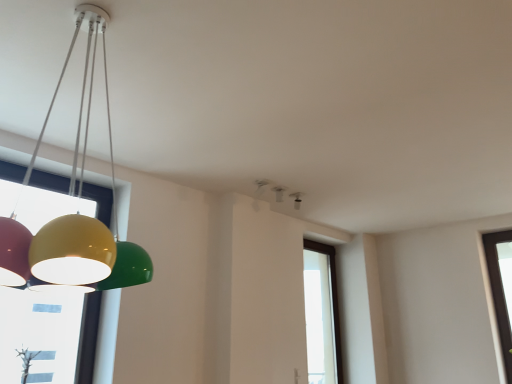
Question: Can glossy plastic lamp at left, the first lamp viewed from the left, be found inside transparent glass window at center?

Choices:
 (A) no
 (B) yes

Answer: (A)

Question: From the image's perspective, would you say transparent glass window at center is shown under glossy plastic lamp at left, which appears as the third lamp when viewed from the right?

Choices:
 (A) yes
 (B) no

Answer: (A)

Question: Considering the relative positions of transparent glass window at center and glossy plastic lamp at left, arranged as the 1th lamp when viewed from the front, in the image provided, is transparent glass window at center in front of glossy plastic lamp at left, arranged as the 1th lamp when viewed from the front,?

Choices:
 (A) no
 (B) yes

Answer: (A)

Question: Is transparent glass window at center smaller than glossy plastic lamp at left, placed as the 3th lamp when sorted from back to front?

Choices:
 (A) no
 (B) yes

Answer: (B)

Question: From the image's perspective, is transparent glass window at center over glossy plastic lamp at left, arranged as the 1th lamp when viewed from the front?

Choices:
 (A) yes
 (B) no

Answer: (B)

Question: Based on their sizes in the image, would you say white plastic smoke detector at upper center, arranged as the 2th lamp when viewed from the back, is bigger or smaller than transparent glass window at center?

Choices:
 (A) small
 (B) big

Answer: (A)

Question: Considering their positions, is white plastic smoke detector at upper center, which appears as the 2th lamp when viewed from the front, located in front of or behind transparent glass window at center?

Choices:
 (A) front
 (B) behind

Answer: (A)

Question: Does point (284, 190) appear closer or farther from the camera than point (308, 304)?

Choices:
 (A) closer
 (B) farther

Answer: (A)

Question: Considering the positions of white plastic smoke detector at upper center, which appears as the 2th lamp when viewed from the front, and transparent glass window at center in the image, is white plastic smoke detector at upper center, which appears as the 2th lamp when viewed from the front, wider or thinner than transparent glass window at center?

Choices:
 (A) wide
 (B) thin

Answer: (A)

Question: From a real-world perspective, is matte black speaker at upper center, the 1th lamp positioned from the back, positioned above or below white plastic smoke detector at upper center, marked as the second lamp in a right-to-left arrangement?

Choices:
 (A) below
 (B) above

Answer: (A)

Question: Is matte black speaker at upper center, the 3th lamp when ordered from left to right, inside the boundaries of white plastic smoke detector at upper center, which ranks as the 2th lamp in left-to-right order, or outside?

Choices:
 (A) inside
 (B) outside

Answer: (B)

Question: In terms of height, does matte black speaker at upper center, the 3th lamp when ordered from left to right, look taller or shorter compared to white plastic smoke detector at upper center, arranged as the 2th lamp when viewed from the back?

Choices:
 (A) short
 (B) tall

Answer: (B)

Question: From the image's perspective, relative to white plastic smoke detector at upper center, which ranks as the 2th lamp in left-to-right order, is matte black speaker at upper center, the 3th lamp when ordered from left to right, above or below?

Choices:
 (A) above
 (B) below

Answer: (B)

Question: In the image, is transparent glass window at center positioned in front of or behind white plastic smoke detector at upper center, marked as the second lamp in a right-to-left arrangement?

Choices:
 (A) front
 (B) behind

Answer: (B)

Question: Is transparent glass window at center wider or thinner than white plastic smoke detector at upper center, which ranks as the 2th lamp in left-to-right order?

Choices:
 (A) thin
 (B) wide

Answer: (A)